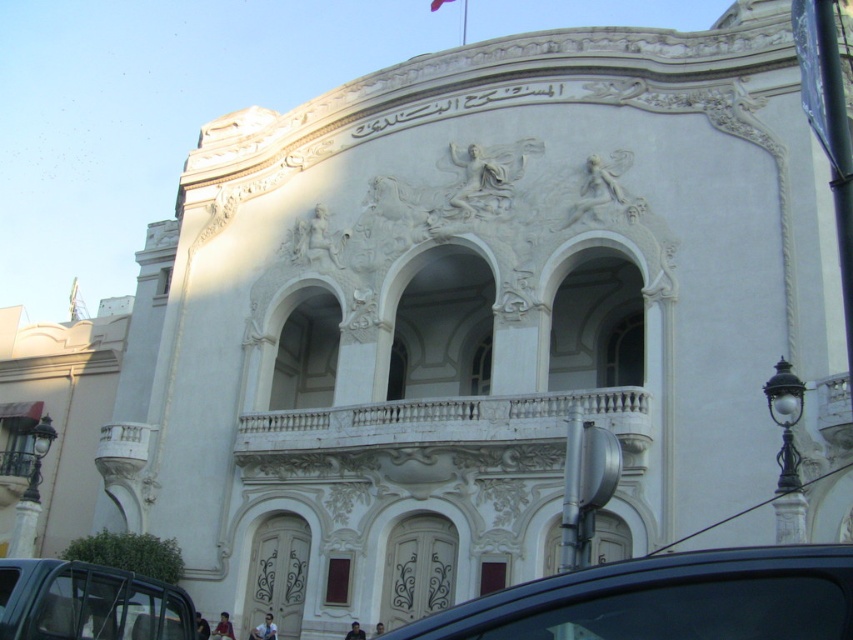
You are a photographer planning to capture the grand building. You have a camera with a lens that can focus on objects up to 5 meters wide. You see the metallic gray car at lower left and the white fabric flag at upper center. Which object should you focus on to ensure it fits within the frame without cropping?

The metallic gray car at lower left has a larger width than the white fabric flag at upper center. Since the lens can focus on objects up to 5 meters wide, you should focus on the metallic gray car at lower left to ensure it fits within the frame without cropping.

You are a photographer planning to capture the grand building. You notice a black glossy car at lower center and a white fabric flag at upper center in your shot. Which object would you need to adjust your camera angle to include fully in the frame if you want to focus on the building?

The black glossy car at lower center is wider than the white fabric flag at upper center, so you would need to adjust your camera angle to include the black glossy car at lower center fully in the frame while focusing on the building.

You are a visitor arriving at the grand building and notice the black glossy car at lower center and the white fabric flag at upper center. Which object is located below the other?

The black glossy car at lower center is positioned under the white fabric flag at upper center, so the car is below the flag.